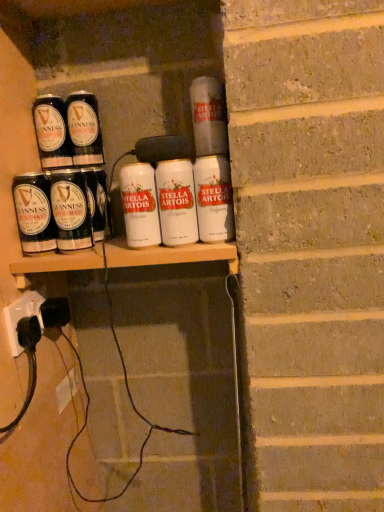
Question: Is white matte tin can at center, which ranks as the fourth tin can in right-to-left order, not within shiny black can at left, positioned as the 5th tin can in right-to-left order?

Choices:
 (A) no
 (B) yes

Answer: (B)

Question: From the image's perspective, does white matte tin can at center, the fifth tin can when ordered from left to right, appear higher than shiny black can at left, positioned as the 5th tin can in right-to-left order?

Choices:
 (A) no
 (B) yes

Answer: (A)

Question: Is white matte tin can at center, which ranks as the fourth tin can in right-to-left order, at the right side of shiny black can at left, placed as the fourth tin can when sorted from left to right?

Choices:
 (A) yes
 (B) no

Answer: (A)

Question: From the image's perspective, is white matte tin can at center, which ranks as the fourth tin can in right-to-left order, below shiny black can at left, placed as the fourth tin can when sorted from left to right?

Choices:
 (A) yes
 (B) no

Answer: (A)

Question: Is white matte tin can at center, which ranks as the fourth tin can in right-to-left order, positioned before shiny black can at left, positioned as the 5th tin can in right-to-left order?

Choices:
 (A) yes
 (B) no

Answer: (A)

Question: Considering the relative sizes of white matte tin can at center, the fifth tin can when ordered from left to right, and shiny black can at left, placed as the fourth tin can when sorted from left to right, in the image provided, is white matte tin can at center, the fifth tin can when ordered from left to right, bigger than shiny black can at left, placed as the fourth tin can when sorted from left to right,?

Choices:
 (A) yes
 (B) no

Answer: (B)

Question: Is shiny black can at left, positioned as the 5th tin can in right-to-left order, taller than white plastic socket at lower left?

Choices:
 (A) yes
 (B) no

Answer: (A)

Question: Can we say shiny black can at left, placed as the fourth tin can when sorted from left to right, lies outside white plastic socket at lower left?

Choices:
 (A) yes
 (B) no

Answer: (A)

Question: Is shiny black can at left, placed as the fourth tin can when sorted from left to right, wider than white plastic socket at lower left?

Choices:
 (A) yes
 (B) no

Answer: (A)

Question: From a real-world perspective, is shiny black can at left, placed as the fourth tin can when sorted from left to right, on white plastic socket at lower left?

Choices:
 (A) no
 (B) yes

Answer: (B)

Question: Is shiny black can at left, positioned as the 5th tin can in right-to-left order, positioned in front of white plastic socket at lower left?

Choices:
 (A) yes
 (B) no

Answer: (B)

Question: Is shiny black can at left, positioned as the 5th tin can in right-to-left order, at the right side of white plastic socket at lower left?

Choices:
 (A) yes
 (B) no

Answer: (A)

Question: Can you confirm if white matte tin can at upper center, the second tin can viewed from the right, is taller than white matte tin can at center, the fifth tin can when ordered from left to right?

Choices:
 (A) yes
 (B) no

Answer: (B)